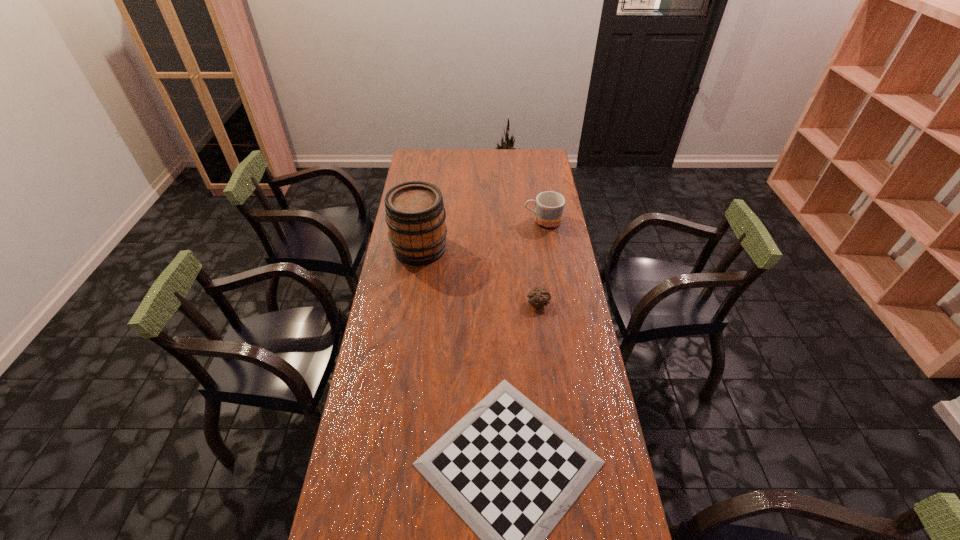
Locate an element on the screen. free space between the second nearest object and the tallest object is located at coordinates (479, 275).

Identify the location of blank region between the third shortest object and the second shortest object. (540, 262).

Find the location of a particular element. The width and height of the screenshot is (960, 540). vacant space in between the third nearest object and the farthest object is located at coordinates (481, 234).

Where is `object that can be found as the second closest to the chessboard`? The height and width of the screenshot is (540, 960). object that can be found as the second closest to the chessboard is located at coordinates (415, 214).

Select which object is the closest to the tallest object. Please provide its 2D coordinates. Your answer should be formatted as a tuple, i.e. [(x, y)], where the tuple contains the x and y coordinates of a point satisfying the conditions above.

[(549, 205)]

Where is `vacant region that satisfies the following two spatial constraints: 1. on the side with the handle of the third shortest object; 2. on the front side of the second shortest object`? The height and width of the screenshot is (540, 960). vacant region that satisfies the following two spatial constraints: 1. on the side with the handle of the third shortest object; 2. on the front side of the second shortest object is located at coordinates (556, 303).